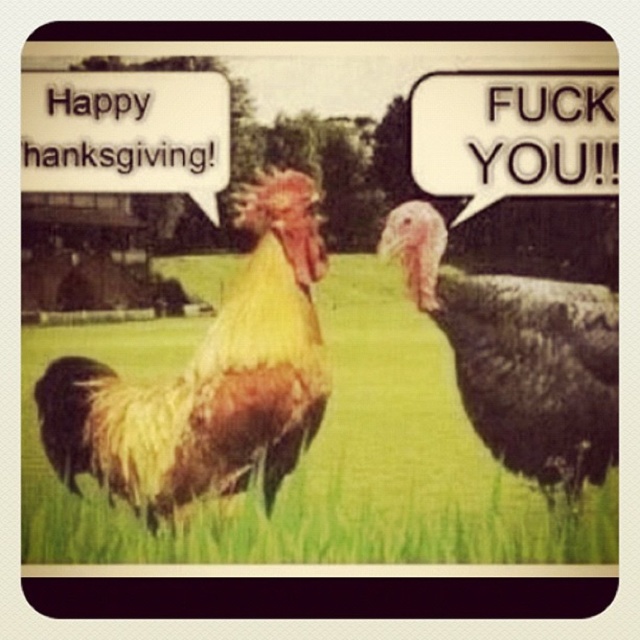
Question: From the image, what is the correct spatial relationship of green grass at center in relation to golden-yellow feathers at center?

Choices:
 (A) right
 (B) left

Answer: (A)

Question: Which point is farther to the camera?

Choices:
 (A) (429, 500)
 (B) (150, 394)
 (C) (576, 304)

Answer: (B)

Question: Is green grass at center smaller than dark gray matte turkey at right?

Choices:
 (A) yes
 (B) no

Answer: (B)

Question: Does green grass at center appear under golden-yellow feathers at center?

Choices:
 (A) yes
 (B) no

Answer: (A)

Question: Which is nearer to the golden-yellow feathers at center?

Choices:
 (A) dark gray matte turkey at right
 (B) green grass at center

Answer: (B)

Question: Which point appears farthest from the camera in this image?

Choices:
 (A) [x=589, y=451]
 (B) [x=214, y=260]
 (C) [x=227, y=364]

Answer: (B)